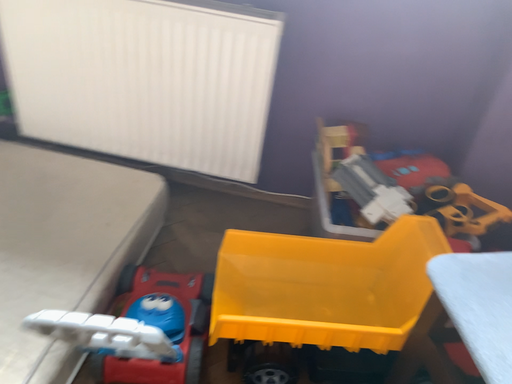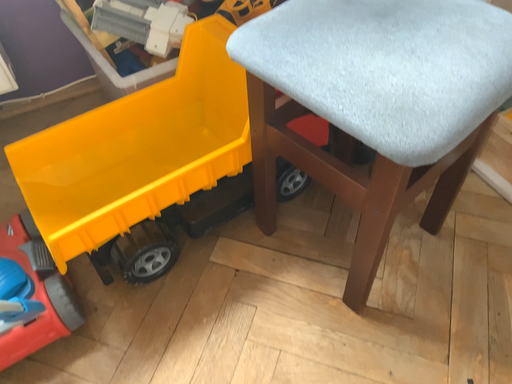
Question: How did the camera likely rotate when shooting the video?

Choices:
 (A) rotated downward
 (B) rotated upward

Answer: (A)